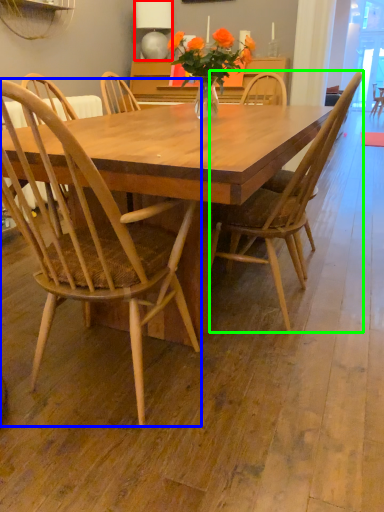
Question: Which object is the farthest from lamp (highlighted by a red box)? Choose among these: chair (highlighted by a blue box) or chair (highlighted by a green box).

Choices:
 (A) chair
 (B) chair

Answer: (A)